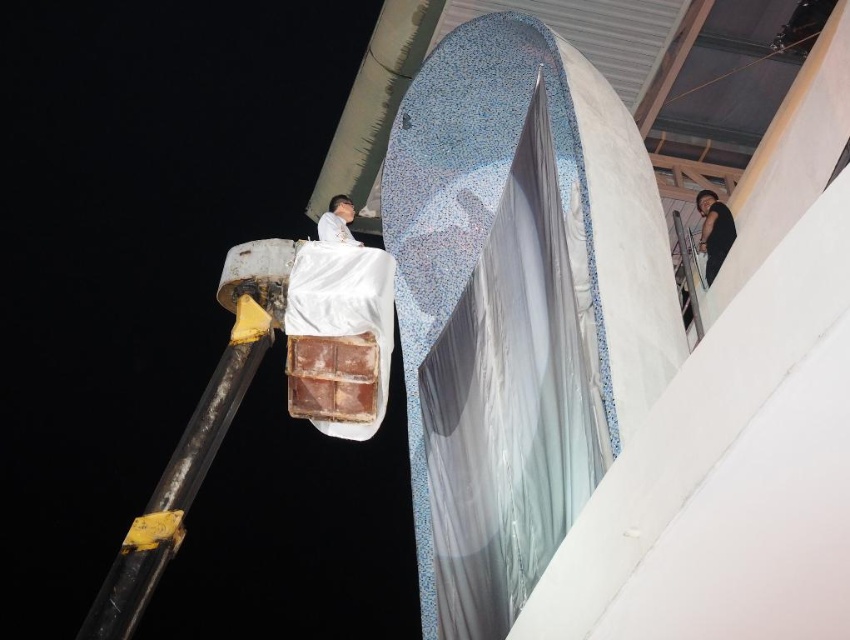
You are standing at the origin point of the scene. There is a black matte shirt at upper right located at point (714, 230). What is the coordinate of the black matte shirt at upper right?

The black matte shirt at upper right is located at point (714, 230).

You are a night security guard patrolling the construction site. You see two workers wearing the black matte shirt at upper right and the matte white shirt at upper center. Which worker is closer to the right side of the structure?

The black matte shirt at upper right is to the right of the matte white shirt at upper center, so the worker in the black matte shirt at upper right is closer to the right side of the structure.

You are a safety inspector at the construction site. You need to ensure that workers are maintaining a safe distance of at least 25 meters apart to prevent accidents. Are the workers wearing black matte shirt at upper right and matte white shirt at upper center complying with the safety regulation?

The black matte shirt at upper right is 24.97 meters from the matte white shirt at upper center. Since the required distance is 25 meters and the actual distance is slightly less, they are not complying with the safety regulation.